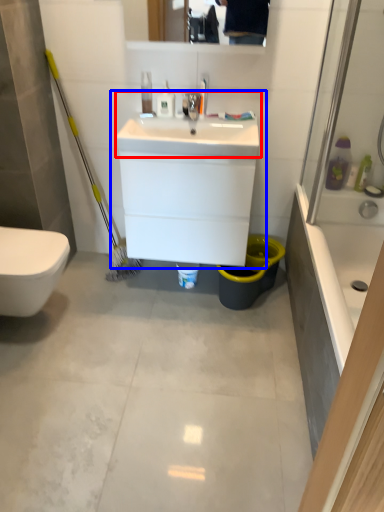
Question: Among these objects, which one is farthest to the camera, sink (highlighted by a red box) or sink (highlighted by a blue box)?

Choices:
 (A) sink
 (B) sink

Answer: (B)